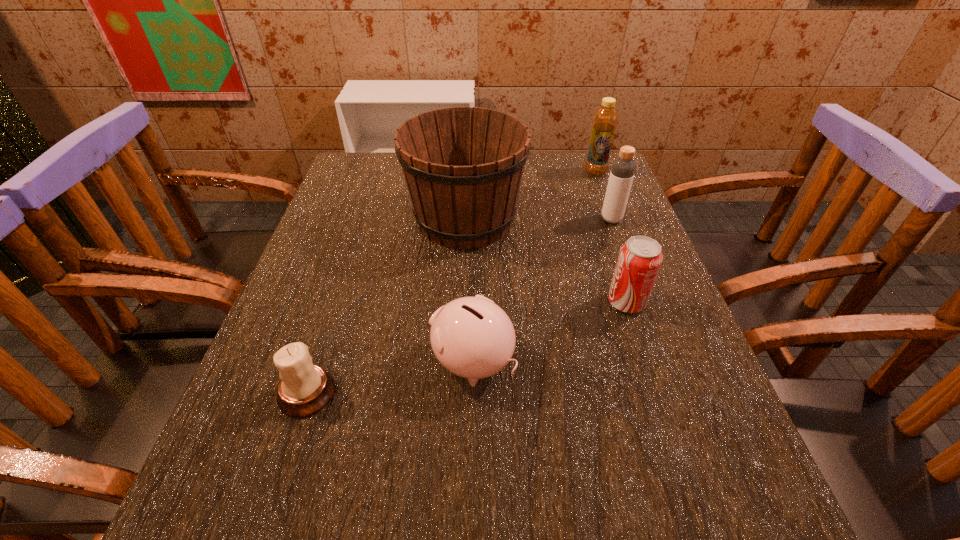
Locate an element on the screen. vacant space that satisfies the following two spatial constraints: 1. on the logo side of the fourth farthest object; 2. on the front side of the piggy bank is located at coordinates (646, 362).